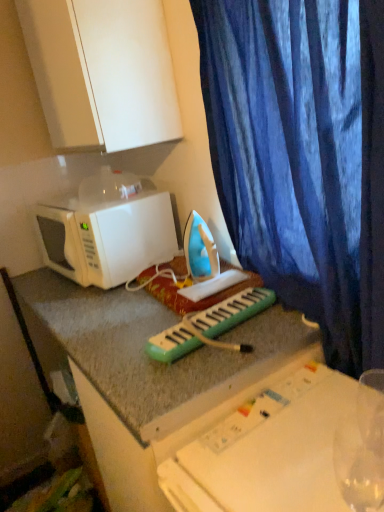
Find the location of `free point above green plastic musical keyboard at center (from a real-world perspective)`. free point above green plastic musical keyboard at center (from a real-world perspective) is located at coordinates (205, 316).